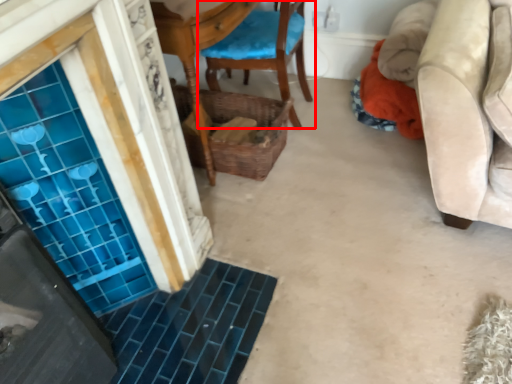
Question: From the image's perspective, where is chair (annotated by the red box) located relative to basket?

Choices:
 (A) below
 (B) above

Answer: (B)